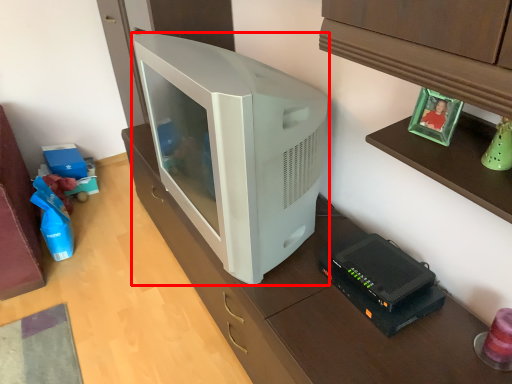
Question: From the image's perspective, where is television (annotated by the red box) located relative to appliance?

Choices:
 (A) above
 (B) below

Answer: (A)